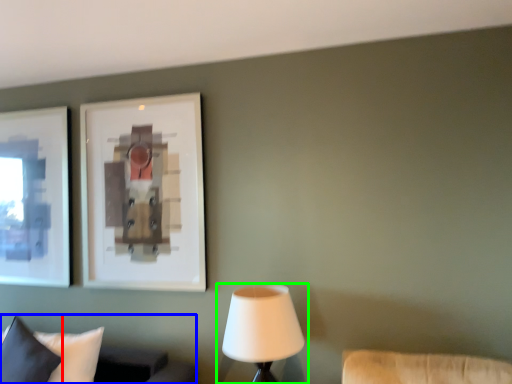
Question: Which object is the closest to the pillow (highlighted by a red box)? Choose among these: furniture (highlighted by a blue box) or lamp (highlighted by a green box).

Choices:
 (A) furniture
 (B) lamp

Answer: (A)